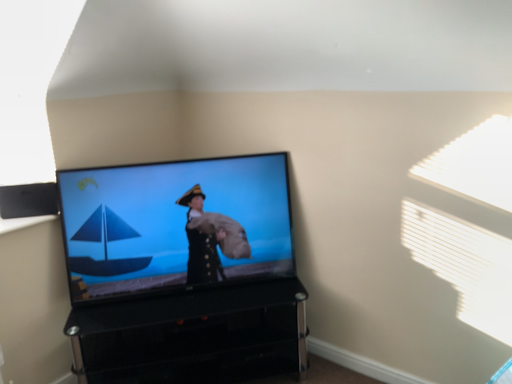
Image resolution: width=512 pixels, height=384 pixels. In order to click on free spot above black glossy tv stand at lower center (from a real-world perspective) in this screenshot , I will do `click(211, 292)`.